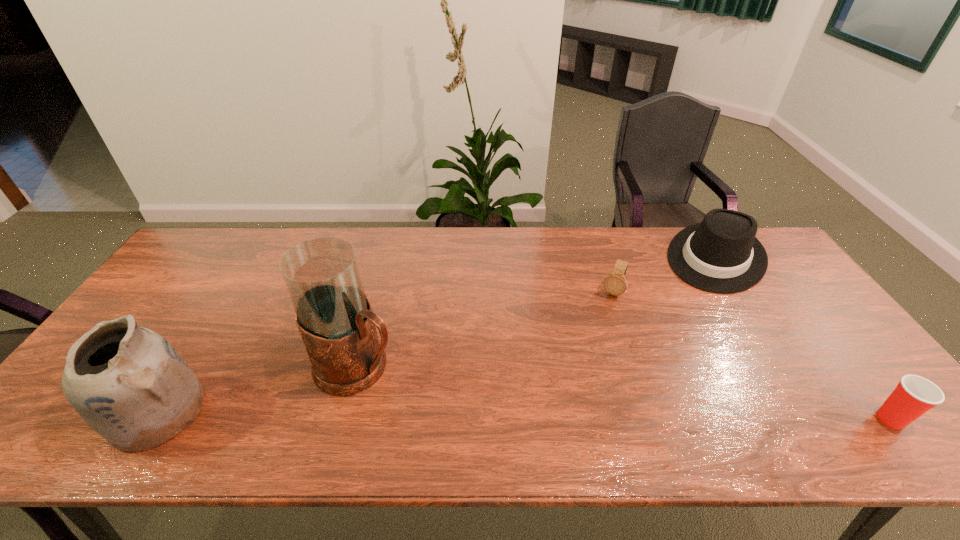
The image size is (960, 540). What are the coordinates of `blank area located on the face of the third object from right to left` in the screenshot? It's located at (577, 378).

This screenshot has height=540, width=960. Find the location of `vacant area situated on the face of the third object from right to left`. vacant area situated on the face of the third object from right to left is located at coordinates (605, 314).

I want to click on vacant area located with the handle on the side of the tallest object, so click(420, 396).

In order to click on free region located 0.050m with the handle on the side of the tallest object in this screenshot , I will do `click(410, 391)`.

What are the coordinates of `free location located 0.170m with the handle on the side of the tallest object` in the screenshot? It's located at coord(450,414).

Where is `free region located on the front-facing side of the third tallest object`? This screenshot has height=540, width=960. free region located on the front-facing side of the third tallest object is located at coordinates (653, 365).

The width and height of the screenshot is (960, 540). What are the coordinates of `blank area located 0.390m on the front-facing side of the third tallest object` in the screenshot? It's located at (651, 367).

The image size is (960, 540). I want to click on free space located 0.220m on the front-facing side of the third tallest object, so click(x=675, y=328).

In order to click on object that is positioned at the far edge in this screenshot , I will do `click(722, 255)`.

Where is `pottery that is positioned at the near edge`? pottery that is positioned at the near edge is located at coordinates (129, 384).